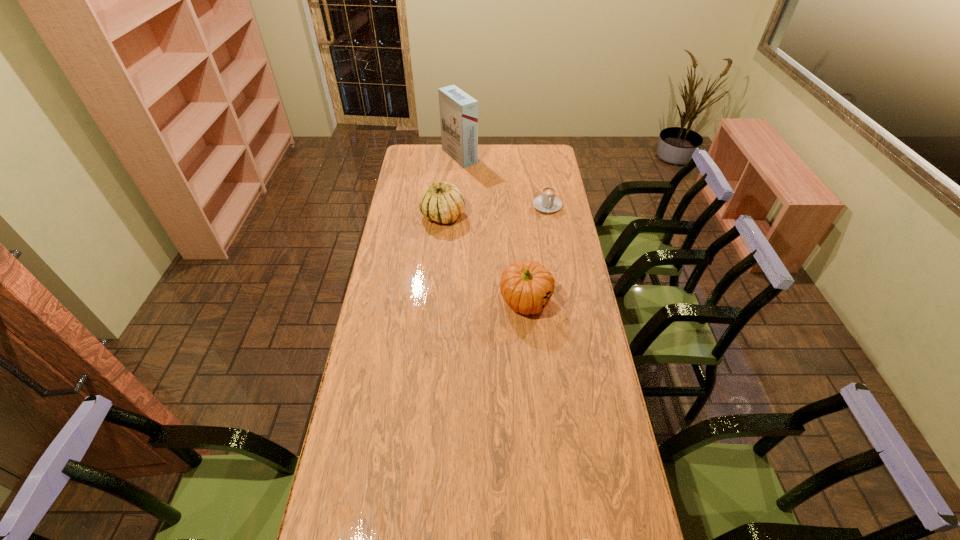
At what (x,y) coordinates should I click in order to perform the action: click on object at the left edge. Please return your answer as a coordinate pair (x, y). Looking at the image, I should click on (442, 202).

Locate an element on the screen. The width and height of the screenshot is (960, 540). pumpkin at the right edge is located at coordinates click(526, 286).

Identify the location of cappuccino situated at the right edge. (547, 202).

I want to click on free space at the far edge, so click(494, 161).

In the image, there is a desktop. Identify the location of vacant space at the left edge. tap(385, 276).

In the image, there is a desktop. Where is `free space at the right edge`? Image resolution: width=960 pixels, height=540 pixels. free space at the right edge is located at coordinates (606, 430).

Locate an element on the screen. vacant space at the far left corner of the desktop is located at coordinates (431, 160).

Identify the location of empty location between the pumpkin and the fourth tallest object. (537, 254).

Where is `vacant area between the fourth farthest object and the gourd`? The image size is (960, 540). vacant area between the fourth farthest object and the gourd is located at coordinates coord(484,259).

This screenshot has width=960, height=540. Find the location of `unoccupied position between the pumpkin and the cappuccino`. unoccupied position between the pumpkin and the cappuccino is located at coordinates (537, 254).